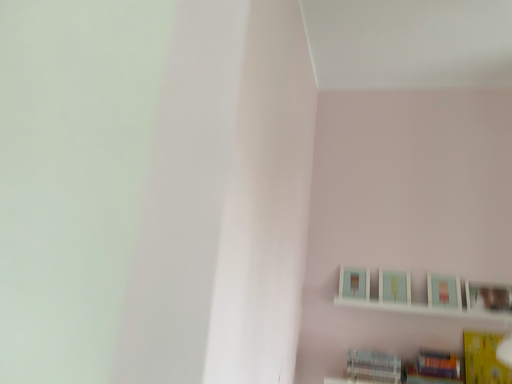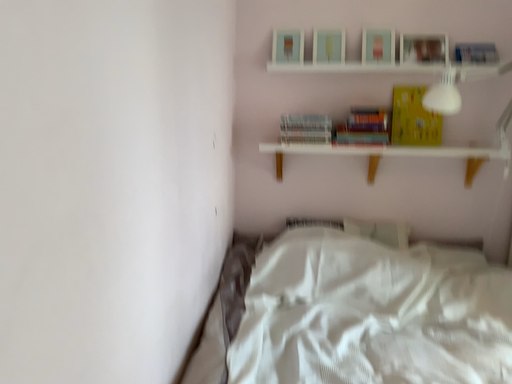
Question: Which way did the camera rotate in the video?

Choices:
 (A) rotated downward
 (B) rotated upward

Answer: (A)